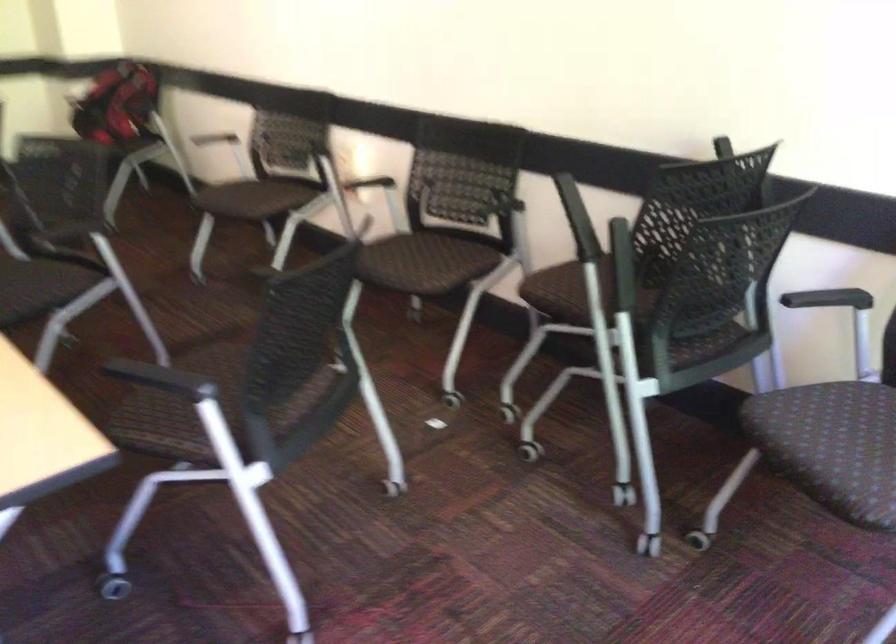
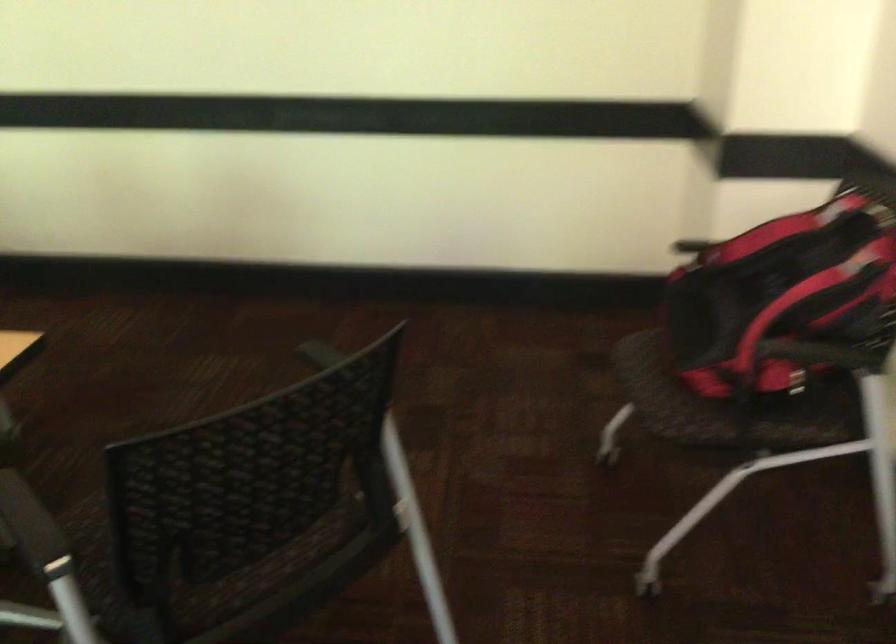
The point at (115,84) is marked in the first image. Where is the corresponding point in the second image?

(785, 283)